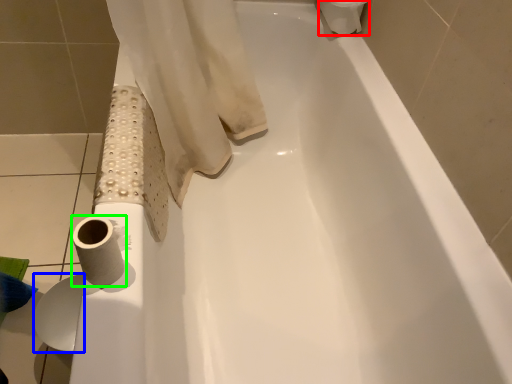
Question: Considering the real-world distances, which object is closest to toilet paper (highlighted by a red box)? toilet paper (highlighted by a blue box) or toilet paper (highlighted by a green box).

Choices:
 (A) toilet paper
 (B) toilet paper

Answer: (B)